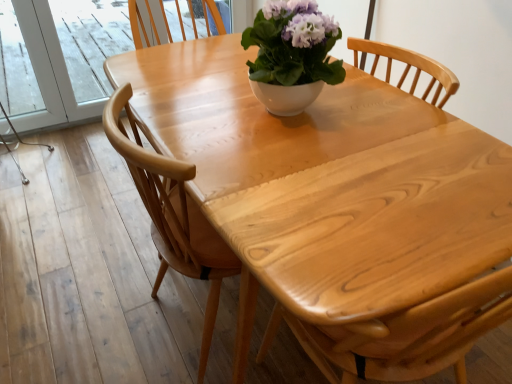
Question: Is light wood chair at center inside the boundaries of white glossy bowl at center, or outside?

Choices:
 (A) outside
 (B) inside

Answer: (A)

Question: From the image's perspective, is light wood chair at center located above or below white glossy bowl at center?

Choices:
 (A) below
 (B) above

Answer: (A)

Question: Which of these objects is positioned farthest from the natural wood table at center?

Choices:
 (A) light wood chair at center
 (B) white glossy bowl at center

Answer: (A)

Question: Considering the real-world distances, which object is farthest from the light wood chair at center?

Choices:
 (A) white glossy bowl at center
 (B) natural wood table at center

Answer: (A)